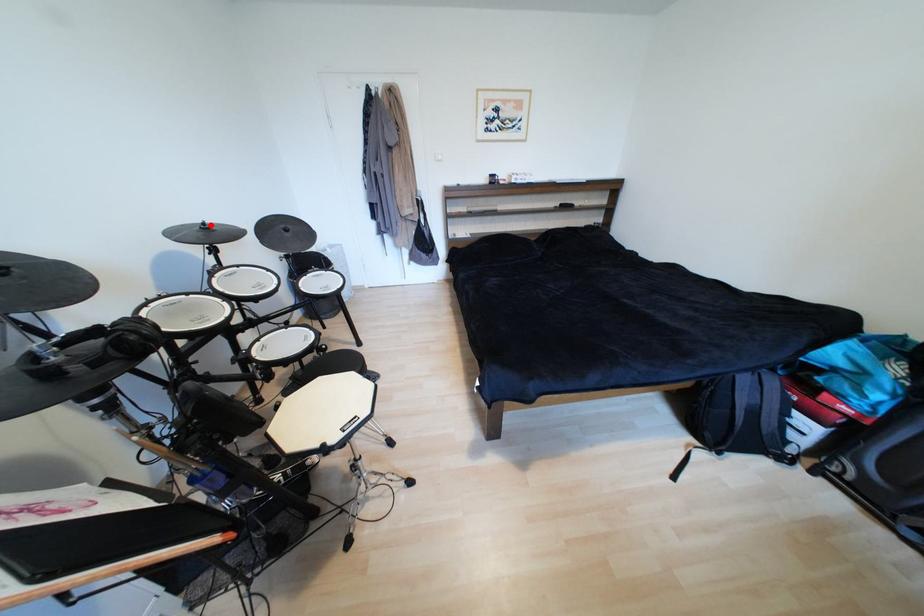
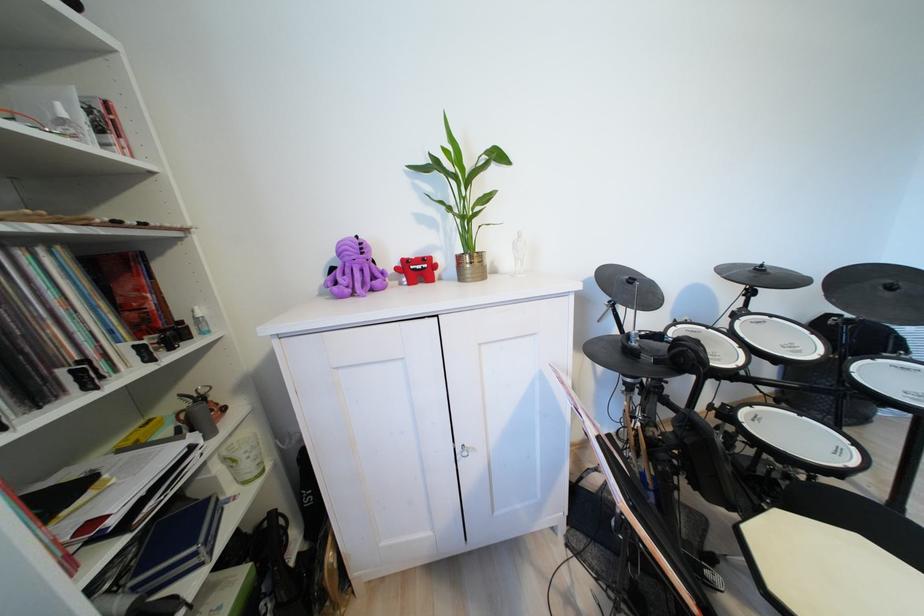
Locate, in the second image, the point that corresponds to the highlighted location in the first image.

(769, 267)